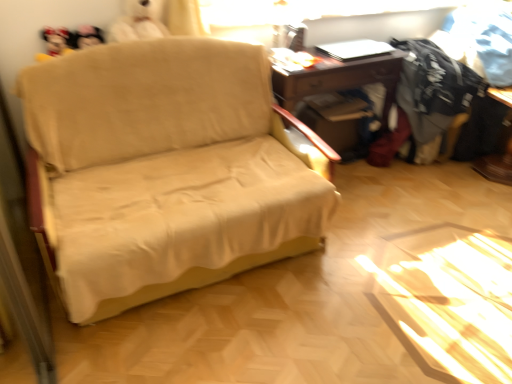
You are a GUI agent. You are given a task and a screenshot of the screen. Output one action in this format:
    pyautogui.click(x=<x>, y=<y>)
    Task: Click on the free location in front of wooden desk at center
    Image resolution: width=512 pixels, height=384 pixels.
    Given the screenshot: What is the action you would take?
    pyautogui.click(x=373, y=206)